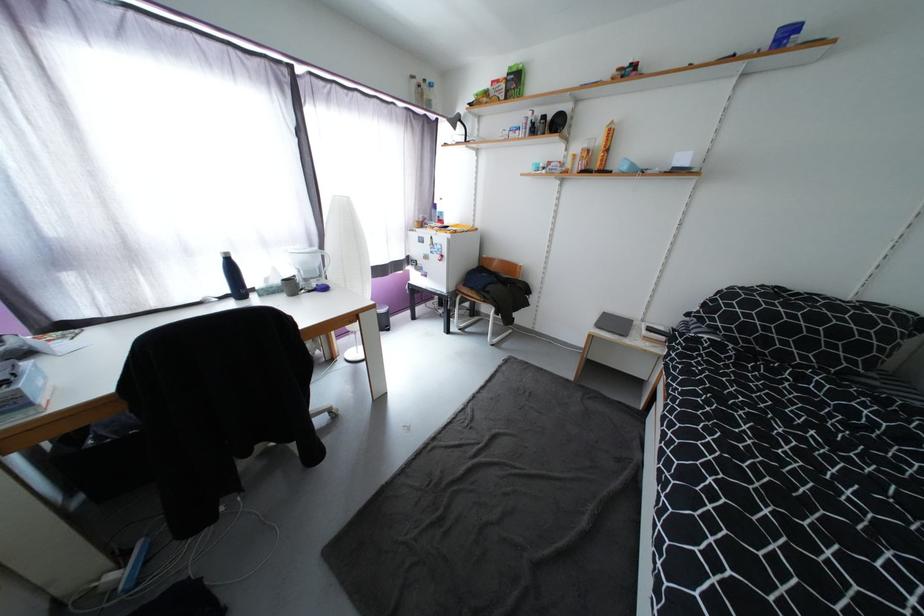
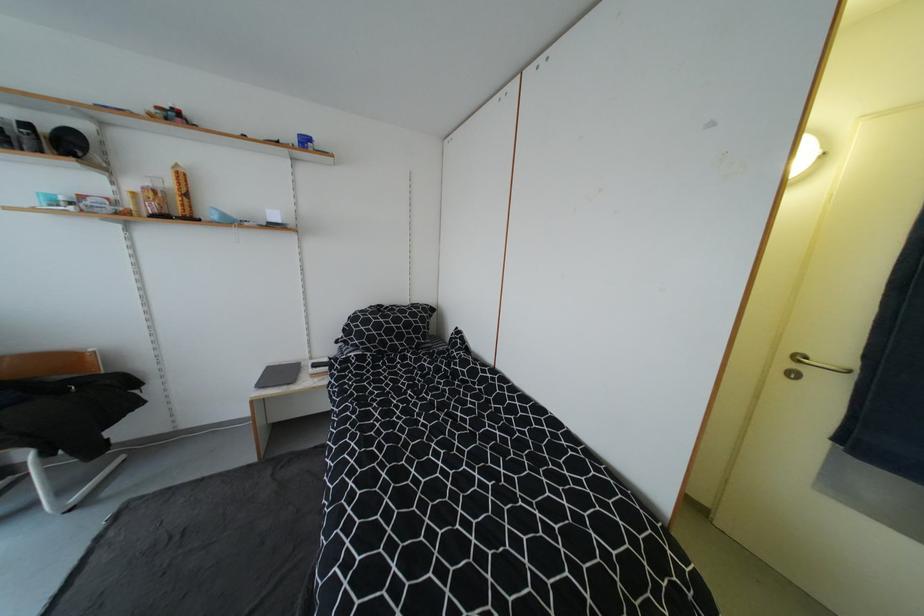
Where in the second image is the point corresponding to (x=593, y=152) from the first image?

(161, 193)